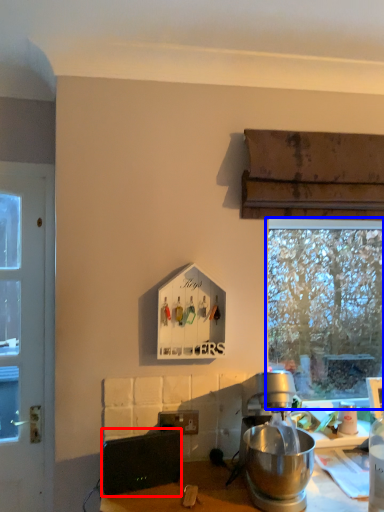
Question: Among these objects, which one is farthest to the camera, appliance (highlighted by a red box) or window (highlighted by a blue box)?

Choices:
 (A) appliance
 (B) window

Answer: (B)